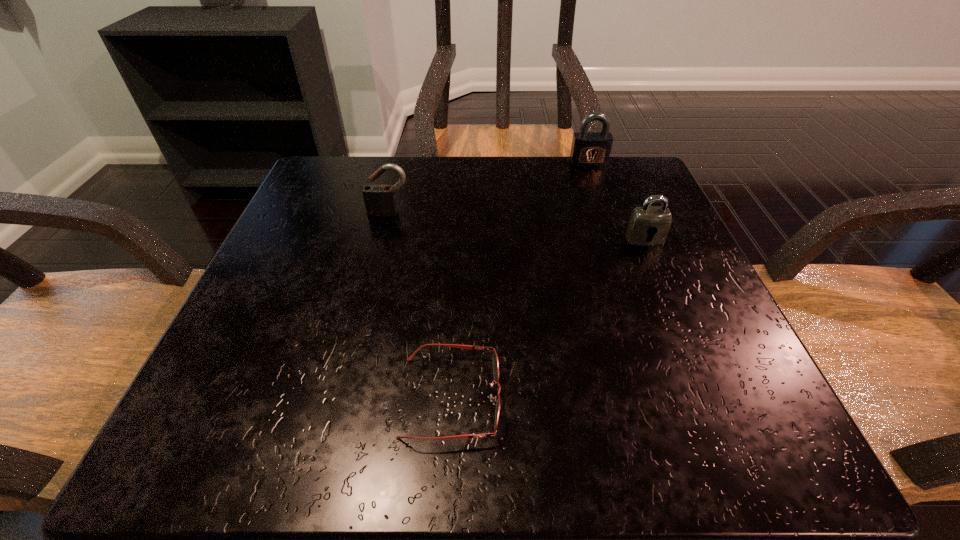
The width and height of the screenshot is (960, 540). I want to click on the farthest object, so click(x=589, y=149).

Locate an element on the screen. The image size is (960, 540). the leftmost padlock is located at coordinates (380, 200).

Identify the location of the third nearest object. The width and height of the screenshot is (960, 540). (380, 200).

This screenshot has width=960, height=540. Identify the location of the third farthest object. (648, 225).

Image resolution: width=960 pixels, height=540 pixels. Identify the location of the third object from right to left. (495, 358).

Where is `the shortest object`? The height and width of the screenshot is (540, 960). the shortest object is located at coordinates (495, 358).

Find the location of a particular element. The image size is (960, 540). vacant space located 0.340m on the front of the farthest object near the keyhole is located at coordinates (626, 272).

Where is `vacant space located 0.080m with the keyhole on the front of the leftmost padlock`? The height and width of the screenshot is (540, 960). vacant space located 0.080m with the keyhole on the front of the leftmost padlock is located at coordinates (382, 243).

Identify the location of vacant space located 0.350m at the front of the nearest padlock near the keyhole. The height and width of the screenshot is (540, 960). (726, 430).

At what (x,y) coordinates should I click in order to perform the action: click on free space located on the lenses of the shortest object. Please return your answer as a coordinate pair (x, y). Image resolution: width=960 pixels, height=540 pixels. Looking at the image, I should click on (600, 397).